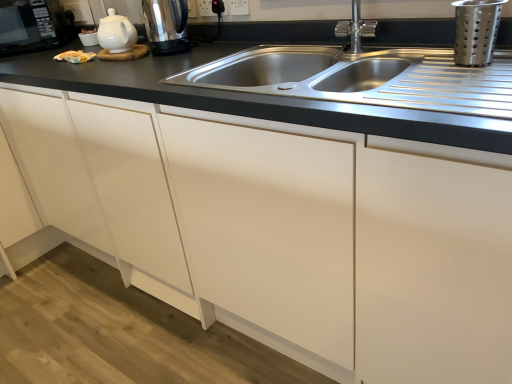
Question: Considering the positions of silver metallic faucet at upper center and polished stainless steel kettle at upper left in the image, is silver metallic faucet at upper center taller or shorter than polished stainless steel kettle at upper left?

Choices:
 (A) short
 (B) tall

Answer: (A)

Question: Considering the positions of silver metallic faucet at upper center and polished stainless steel kettle at upper left in the image, is silver metallic faucet at upper center bigger or smaller than polished stainless steel kettle at upper left?

Choices:
 (A) big
 (B) small

Answer: (B)

Question: Estimate the real-world distances between objects in this image. Which object is farther from the white plastic electric outlet at upper center, the second electric outlet in the left-to-right sequence?

Choices:
 (A) polished stainless steel kettle at upper left
 (B) black plastic outlet at upper center, which appears as the second electric outlet when viewed from the right
 (C) stainless steel sink at center
 (D) silver metallic faucet at upper center
 (E) matte white microwave at upper left, marked as the first appliance in a top-to-bottom arrangement

Answer: (E)

Question: Which object is the farthest from the stainless steel sink at center?

Choices:
 (A) black plastic outlet at upper center, which appears as the second electric outlet when viewed from the right
 (B) polished stainless steel kettle at upper left
 (C) silver metallic faucet at upper center
 (D) matte white microwave at upper left, the first appliance when ordered from back to front
 (E) white plastic electric outlet at upper center, the second electric outlet in the left-to-right sequence

Answer: (C)